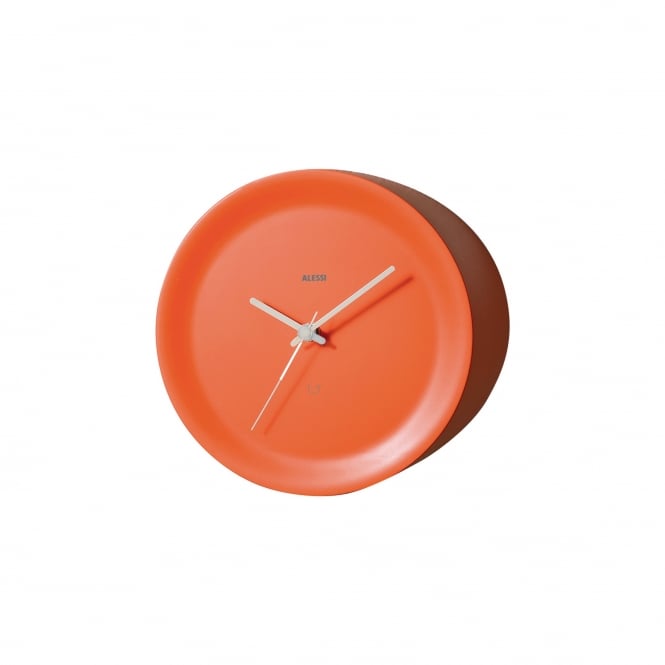
Locate an element on the screen. clock is located at coordinates (350, 408).